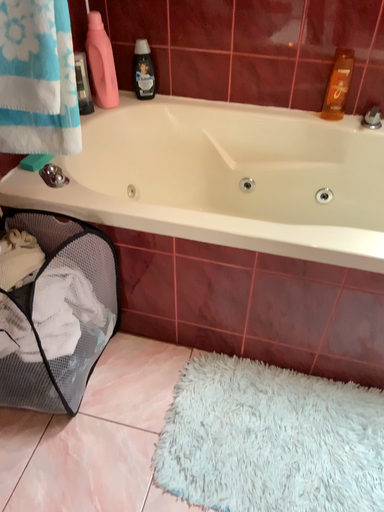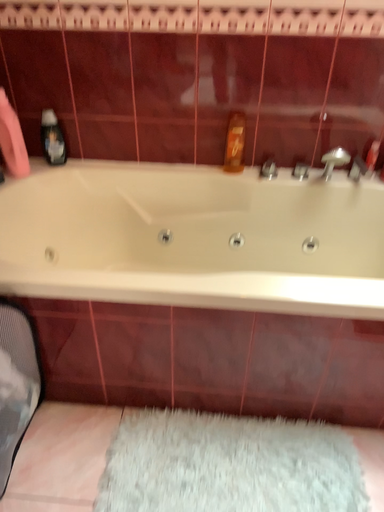
Question: Which way did the camera rotate in the video?

Choices:
 (A) rotated left
 (B) rotated right

Answer: (B)